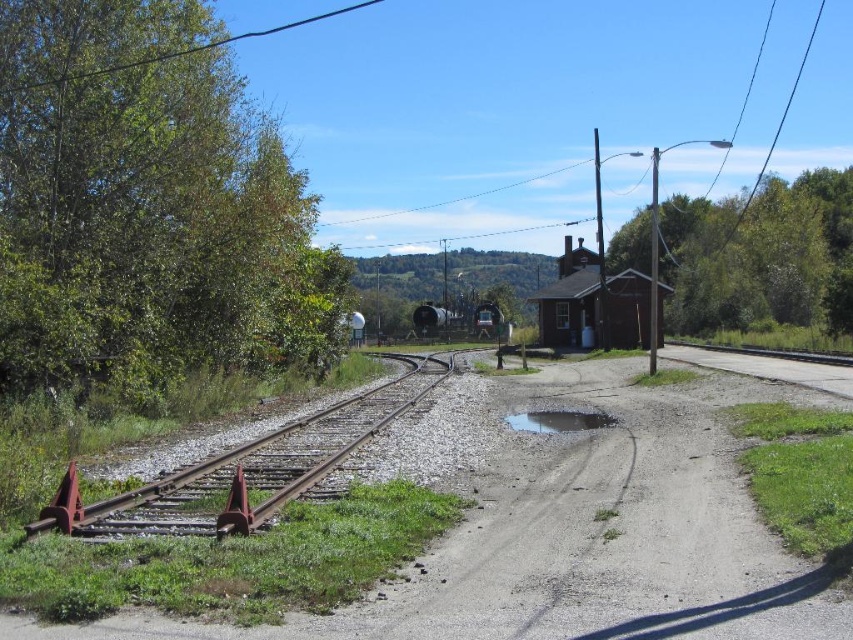
Question: Which object is closer to the camera taking this photo?

Choices:
 (A) rusty metal train track at left
 (B) green leafy tree at upper center
 (C) glossy concrete puddle at center
 (D) green leafy tree at center

Answer: (A)

Question: Is green leafy tree at left below glossy concrete puddle at center?

Choices:
 (A) yes
 (B) no

Answer: (B)

Question: Which point is farther to the camera?

Choices:
 (A) glossy concrete puddle at center
 (B) rusty metal train track at left
 (C) green leafy tree at upper center

Answer: (C)

Question: Is green leafy tree at left closer to camera compared to glossy concrete puddle at center?

Choices:
 (A) yes
 (B) no

Answer: (A)

Question: Is green leafy tree at left above glossy concrete puddle at center?

Choices:
 (A) no
 (B) yes

Answer: (B)

Question: Considering the real-world distances, which object is closest to the glossy concrete puddle at center?

Choices:
 (A) rusty metal train track at left
 (B) green leafy tree at center
 (C) green leafy tree at left
 (D) green leafy tree at upper center

Answer: (A)